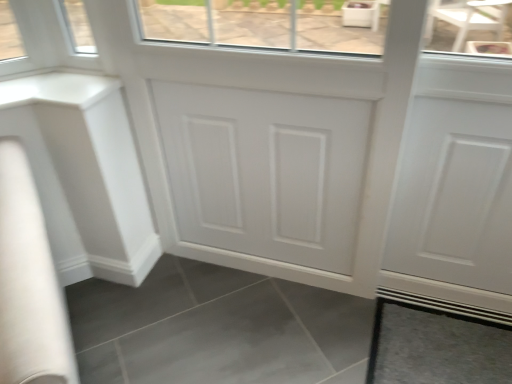
What do you see at coordinates (436, 347) in the screenshot? The width and height of the screenshot is (512, 384). I see `gray matte tile at lower right` at bounding box center [436, 347].

Identify the location of gray matte tile at lower right. The height and width of the screenshot is (384, 512). (436, 347).

Measure the distance between point (x=4, y=92) and camera.

The depth of point (x=4, y=92) is 1.29 meters.

At what (x,y) coordinates should I click in order to perform the action: click on white matte counter top at left. Please return your answer as a coordinate pair (x, y). Looking at the image, I should click on (57, 89).

This screenshot has height=384, width=512. Describe the element at coordinates (57, 89) in the screenshot. I see `white matte counter top at left` at that location.

This screenshot has height=384, width=512. I want to click on gray matte tile at lower right, so click(436, 347).

Between white matte counter top at left and gray matte tile at lower right, which one appears on the left side from the viewer's perspective?

Positioned to the left is white matte counter top at left.

Is white matte counter top at left closer to camera compared to gray matte tile at lower right?

Yes, white matte counter top at left is in front of gray matte tile at lower right.

Which point is more forward, (62, 94) or (437, 377)?

The point (62, 94) is closer to the camera.

From the image's perspective, between white matte counter top at left and gray matte tile at lower right, who is located below?

gray matte tile at lower right is shown below in the image.

From a real-world perspective, is white matte counter top at left on top of gray matte tile at lower right?

Yes.

Is white matte counter top at left thinner than gray matte tile at lower right?

Indeed, white matte counter top at left has a lesser width compared to gray matte tile at lower right.

Who is shorter, white matte counter top at left or gray matte tile at lower right?

With less height is gray matte tile at lower right.

Does white matte counter top at left have a larger size compared to gray matte tile at lower right?

Yes.

Which is correct: white matte counter top at left is inside gray matte tile at lower right, or outside of it?

white matte counter top at left is located beyond the bounds of gray matte tile at lower right.

Is white matte counter top at left not near gray matte tile at lower right?

Yes, white matte counter top at left and gray matte tile at lower right are located far from each other.

Is white matte counter top at left oriented away from gray matte tile at lower right?

No, white matte counter top at left is not facing the opposite direction of gray matte tile at lower right.

Locate an element on the screen. The image size is (512, 384). counter top in front of the gray matte tile at lower right is located at coordinates (57, 89).

Does gray matte tile at lower right appear on the left side of white matte counter top at left?

No, gray matte tile at lower right is not to the left of white matte counter top at left.

Considering the positions of objects gray matte tile at lower right and white matte counter top at left in the image provided, who is behind, gray matte tile at lower right or white matte counter top at left?

Positioned behind is gray matte tile at lower right.

Is point (471, 373) farther from viewer compared to point (41, 101)?

Yes, it is.

From the image's perspective, is gray matte tile at lower right above white matte counter top at left?

No.

In the scene shown: From a real-world perspective, between gray matte tile at lower right and white matte counter top at left, who is vertically higher?

white matte counter top at left, from a real-world perspective.

Considering the relative sizes of gray matte tile at lower right and white matte counter top at left in the image provided, is gray matte tile at lower right thinner than white matte counter top at left?

Incorrect, the width of gray matte tile at lower right is not less than that of white matte counter top at left.

Is gray matte tile at lower right shorter than white matte counter top at left?

Indeed, gray matte tile at lower right has a lesser height compared to white matte counter top at left.

Considering the sizes of objects gray matte tile at lower right and white matte counter top at left in the image provided, who is smaller, gray matte tile at lower right or white matte counter top at left?

gray matte tile at lower right is smaller.

Is gray matte tile at lower right spatially inside white matte counter top at left, or outside of it?

gray matte tile at lower right lies outside white matte counter top at left.

Are gray matte tile at lower right and white matte counter top at left beside each other?

No, gray matte tile at lower right is not next to white matte counter top at left.

Is gray matte tile at lower right aimed at white matte counter top at left?

No.

What's the angular difference between gray matte tile at lower right and white matte counter top at left's facing directions?

The angle between the facing direction of gray matte tile at lower right and the facing direction of white matte counter top at left is 0.592 degrees.

At what (x,y) coordinates should I click in order to perform the action: click on counter top on the left side of gray matte tile at lower right. Please return your answer as a coordinate pair (x, y). The image size is (512, 384). Looking at the image, I should click on (57, 89).

Image resolution: width=512 pixels, height=384 pixels. I want to click on counter top on the left of gray matte tile at lower right, so click(x=57, y=89).

This screenshot has width=512, height=384. In order to click on counter top above the gray matte tile at lower right (from a real-world perspective) in this screenshot , I will do `click(57, 89)`.